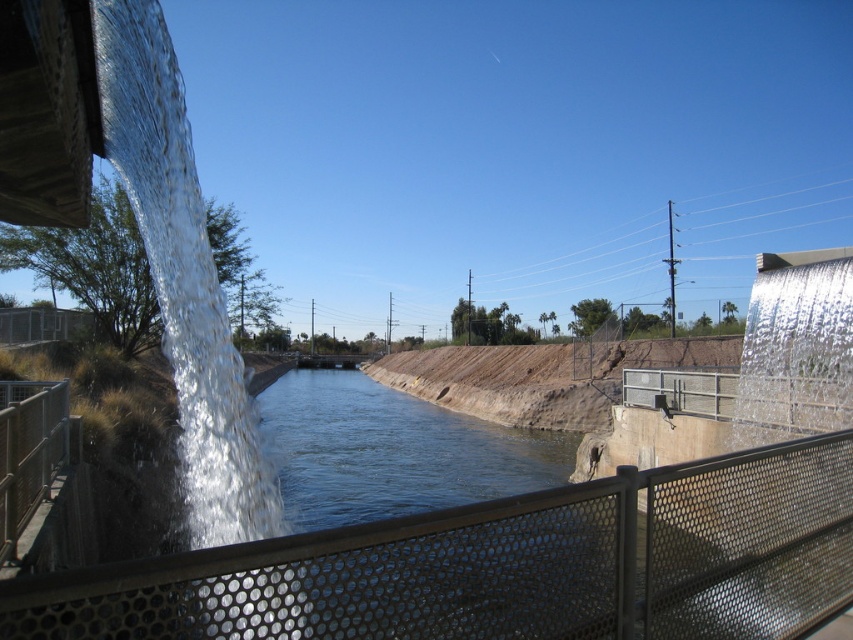
Does metal mesh fence at center have a lesser height compared to metal mesh fence at left?

Incorrect, metal mesh fence at center's height does not fall short of metal mesh fence at left's.

You are a GUI agent. You are given a task and a screenshot of the screen. Output one action in this format:
    pyautogui.click(x=<x>, y=<y>)
    Task: Click on the metal mesh fence at center
    
    Given the screenshot: What is the action you would take?
    pyautogui.click(x=508, y=564)

I want to click on metal mesh fence at center, so click(508, 564).

The image size is (853, 640). What are the coordinates of `metal mesh fence at center` in the screenshot? It's located at (508, 564).